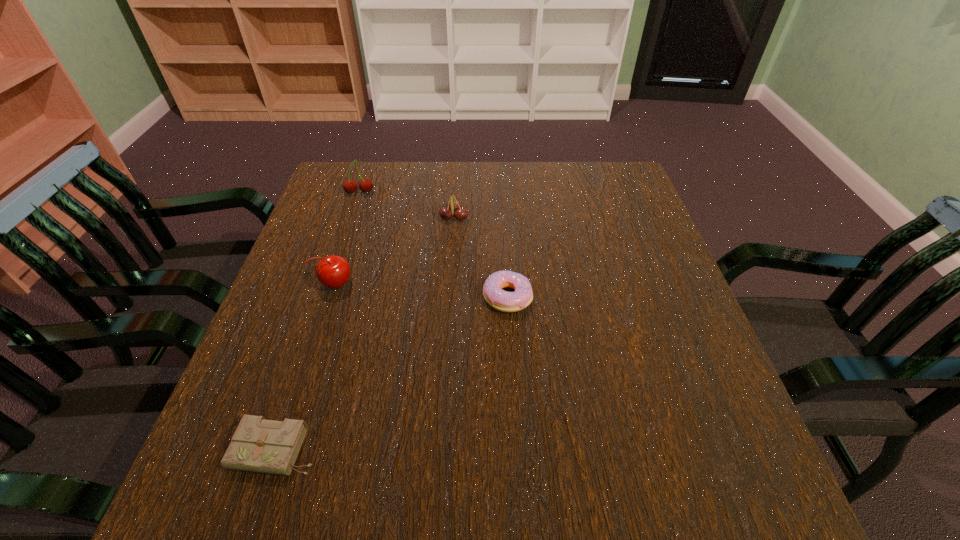
Find the location of `vacant space that's between the second tallest object and the fourth object from left to right`. vacant space that's between the second tallest object and the fourth object from left to right is located at coordinates (395, 251).

You are a GUI agent. You are given a task and a screenshot of the screen. Output one action in this format:
    pyautogui.click(x=<x>, y=<y>)
    Task: Click on the free space between the second tallest cherry and the rightmost cherry
    The width and height of the screenshot is (960, 540).
    Given the screenshot: What is the action you would take?
    pyautogui.click(x=395, y=251)

The width and height of the screenshot is (960, 540). Find the location of `free space between the fourth tallest object and the nearest cherry`. free space between the fourth tallest object and the nearest cherry is located at coordinates (421, 291).

Locate an element on the screen. vacant area that lies between the shortest object and the second nearest cherry is located at coordinates (365, 334).

This screenshot has height=540, width=960. In order to click on object that is the third closest to the farthest cherry in this screenshot , I will do `click(501, 300)`.

The height and width of the screenshot is (540, 960). Find the location of `object that is the closest one to the shortest cherry`. object that is the closest one to the shortest cherry is located at coordinates (501, 300).

Locate an element on the screen. cherry that stands as the closest to the farthest object is located at coordinates (453, 206).

Choose which cherry is the nearest neighbor to the nearest cherry. Please provide its 2D coordinates. Your answer should be formatted as a tuple, i.e. [(x, y)], where the tuple contains the x and y coordinates of a point satisfying the conditions above.

[(453, 206)]

This screenshot has width=960, height=540. In order to click on free space in the image that satisfies the following two spatial constraints: 1. on the surface of the shortest object; 2. on the left side of the farthest cherry in this screenshot , I will do `click(273, 449)`.

Image resolution: width=960 pixels, height=540 pixels. I want to click on free space that satisfies the following two spatial constraints: 1. on the leaves of the second nearest cherry; 2. on the front side of the nearest cherry, so click(x=449, y=284).